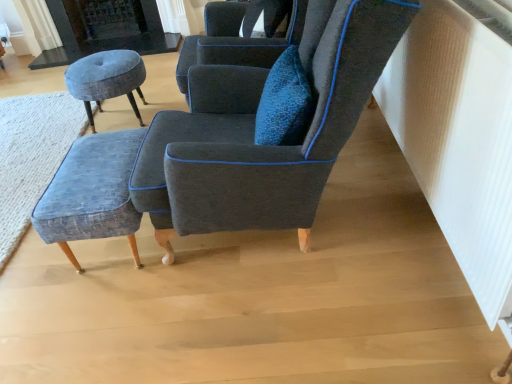
The image size is (512, 384). In order to click on vacant area that is in front of velvet blue armchair at center, placed as the second chair when sorted from back to front in this screenshot , I will do `click(288, 328)`.